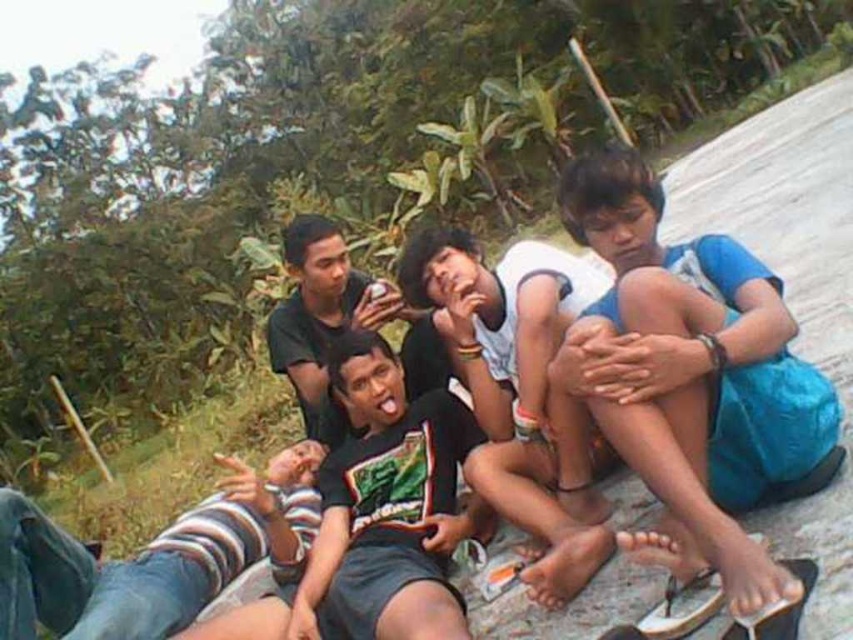
Looking at this image, you are standing in front of the group of young men. You want to take a photo of them from a distance of 4 meters. Can you step back to the point at coordinates point (283,333) to take the photo?

The distance of point (283,333) from viewer is 3.88 meters, so stepping back to that point would place you closer than 4 meters, making it unsuitable for taking the photo from exactly 4 meters away.

You are a photographer trying to capture the group of young men in the scene. You want to ensure that both the black matte shirt at center and the white rubber sandal at lower right are visible in your shot. Based on their positions, which object should you focus on first to frame the shot properly?

The black matte shirt at center is above the white rubber sandal at lower right, so you should focus on the black matte shirt at center first to ensure it stays in frame while adjusting the camera angle downward to include the white rubber sandal at lower right.

You are a photographer trying to capture the group of friends in the scene. You notice the black matte shirt at center and the white rubber sandal at lower right. Which object should you focus on first if you want to ensure both are in sharp focus, considering their sizes?

The black matte shirt at center is thinner than the white rubber sandal at lower right, so you should focus on the white rubber sandal at lower right first since it is larger and will require more precise focusing to ensure sharpness.